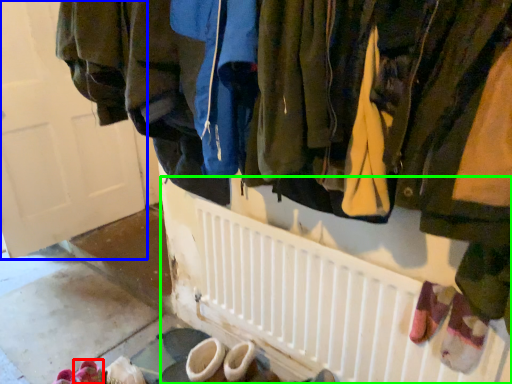
Question: Which object is the farthest from footwear (highlighted by a red box)? Choose among these: door (highlighted by a blue box) or radiator (highlighted by a green box).

Choices:
 (A) door
 (B) radiator

Answer: (A)